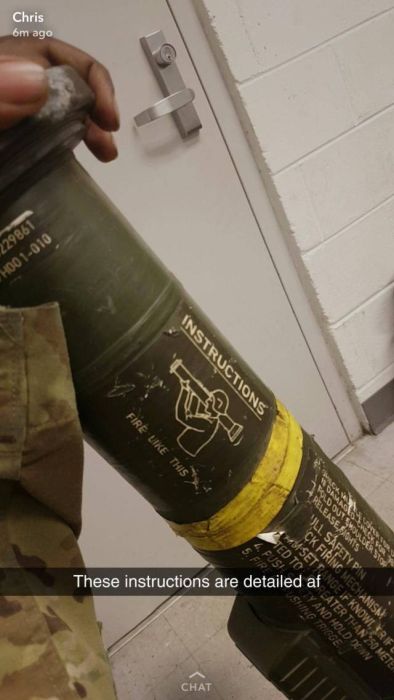
Locate an element on the screen. This screenshot has width=394, height=700. baseboard is located at coordinates (381, 400).